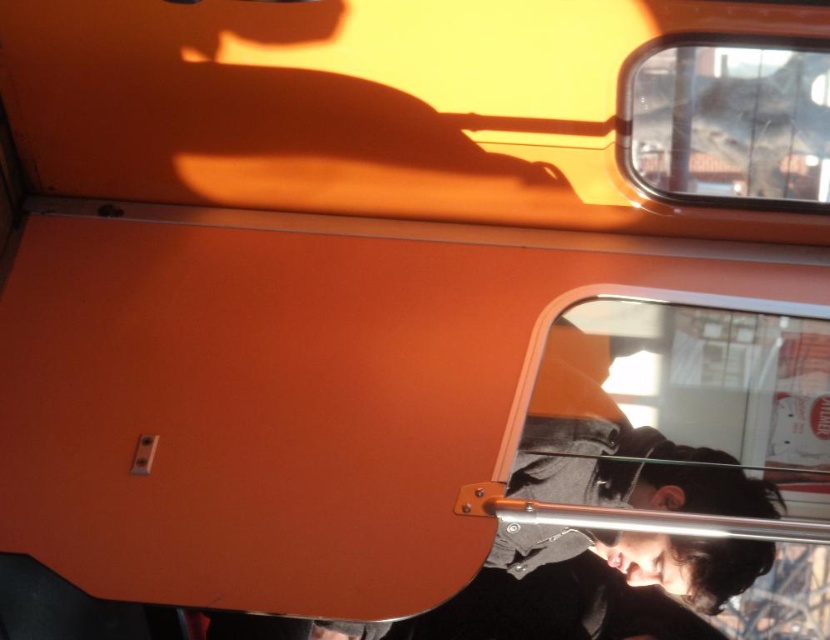
You are a passenger on a bus and want to look outside. You see the transparent glass window at lower right and the transparent glass train window at upper right. Which window is located lower on the vehicle?

The transparent glass window at lower right is positioned under the transparent glass train window at upper right, so it is located lower on the vehicle.

You are a passenger on a bus and need to look outside. There are two windows available, the transparent glass window at lower right and the transparent glass train window at upper right. Which window is closer to you?

The transparent glass window at lower right is closer to you since it is only 17.31 inches away from the transparent glass train window at upper right.

You are a passenger on a bus and need to choose between the transparent glass window at lower right and the transparent glass train window at upper right to look outside. Which window has a wider opening for viewing the outside?

The transparent glass window at lower right has a wider opening for viewing the outside since its width is larger than the transparent glass train window at upper right.